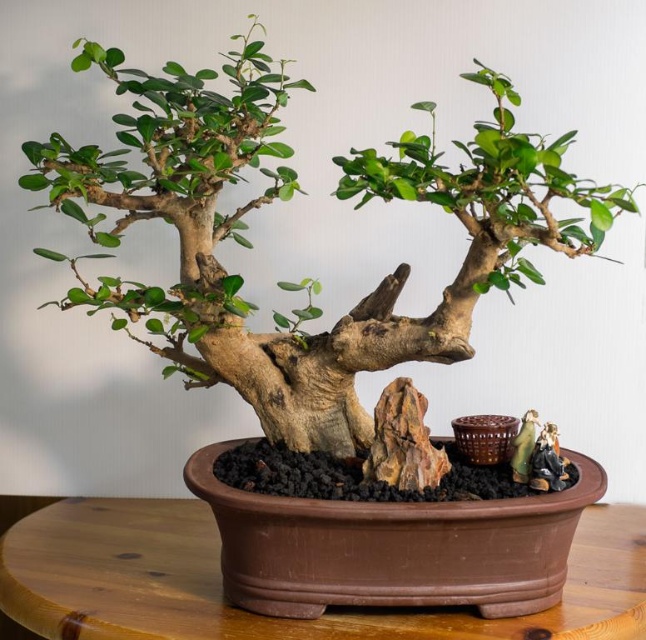
Question: Can you confirm if brown textured bonsai tree at center is positioned above brown wooden table at center?

Choices:
 (A) yes
 (B) no

Answer: (A)

Question: Is brown textured bonsai tree at center bigger than brown wooden table at center?

Choices:
 (A) no
 (B) yes

Answer: (B)

Question: Which of the following is the closest to the observer?

Choices:
 (A) brown textured bonsai tree at center
 (B) brown wooden table at center

Answer: (A)

Question: Can you confirm if brown textured bonsai tree at center is positioned to the right of brown wooden table at center?

Choices:
 (A) no
 (B) yes

Answer: (A)

Question: Which object appears closest to the camera in this image?

Choices:
 (A) brown wooden table at center
 (B) brown textured bonsai tree at center

Answer: (B)

Question: Among these objects, which one is nearest to the camera?

Choices:
 (A) brown wooden table at center
 (B) brown textured bonsai tree at center

Answer: (B)